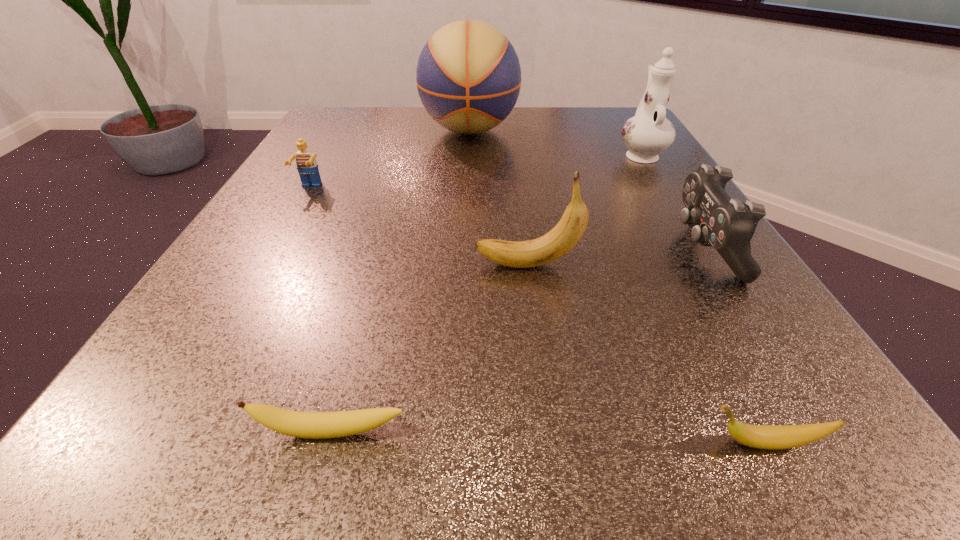
I want to click on object that is at the near left corner, so click(314, 425).

Locate an element on the screen. This screenshot has height=540, width=960. object that is at the far right corner is located at coordinates (648, 133).

At what (x,y) coordinates should I click in order to perform the action: click on object that is at the near right corner. Please return your answer as a coordinate pair (x, y). Looking at the image, I should click on (773, 437).

In order to click on blank space at the far edge of the desktop in this screenshot , I will do `click(510, 119)`.

I want to click on vacant space at the near edge, so click(499, 420).

You are a GUI agent. You are given a task and a screenshot of the screen. Output one action in this format:
    pyautogui.click(x=<x>, y=<y>)
    Task: Click on the free spot at the left edge of the desktop
    This screenshot has width=960, height=540.
    Given the screenshot: What is the action you would take?
    pyautogui.click(x=331, y=227)

This screenshot has width=960, height=540. I want to click on free spot at the right edge of the desktop, so click(633, 245).

In the image, there is a desktop. Where is `vacant space at the far left corner`? The height and width of the screenshot is (540, 960). vacant space at the far left corner is located at coordinates (363, 109).

Identify the location of free space between the second banana from left to right and the fourth tallest object. The image size is (960, 540). (615, 256).

At what (x,y) coordinates should I click in order to perform the action: click on vacant region between the leftmost banana and the chinaware. Please return your answer as a coordinate pair (x, y). The image size is (960, 540). Looking at the image, I should click on (486, 293).